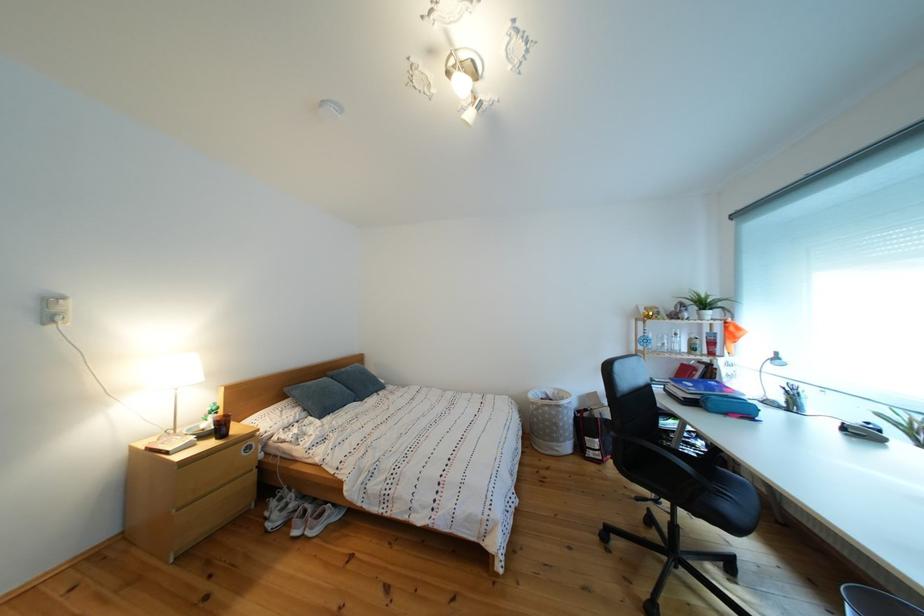
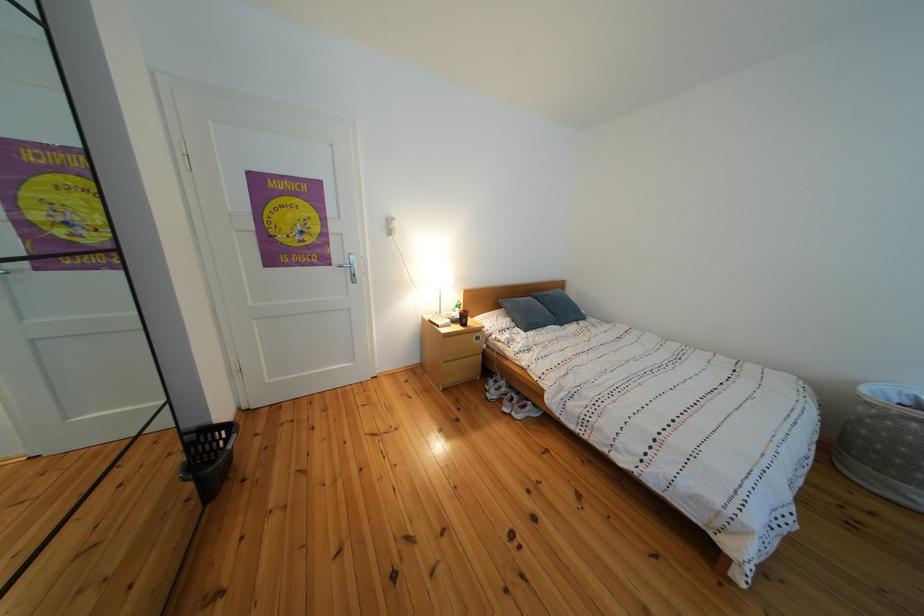
In the second image, find the point that corresponds to (x=165, y=445) in the first image.

(443, 322)